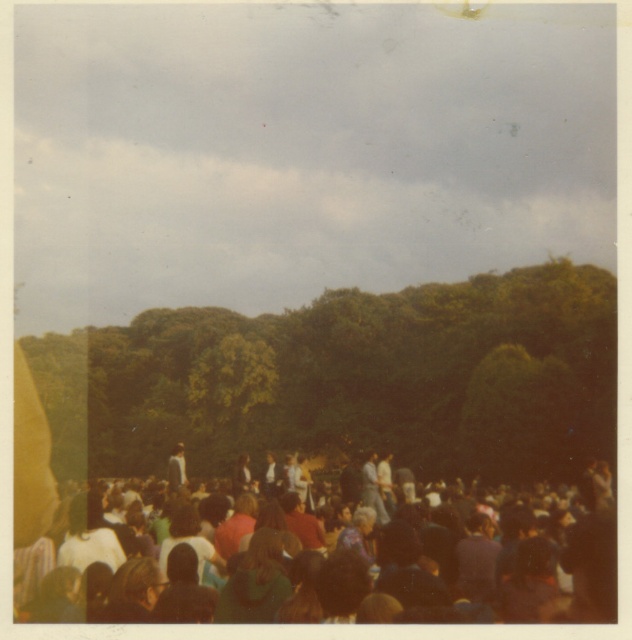
You are a photographer at the event and want to capture a photo that includes both the green leafy tree at center and the multicolored fabric crowd at lower center. Which object should you position closer to the front of your photo to ensure both are visible?

Since the green leafy tree at center is much taller than the multicolored fabric crowd at lower center, you should position the multicolored fabric crowd at lower center closer to the front of your photo to ensure both are visible.

You are a photographer at the event and want to capture a photo that includes both the green leafy tree at center and the multicolored fabric crowd at lower center. However, you need to ensure that the crowd is visible in the background. Is the current arrangement of these objects suitable for this purpose?

The multicolored fabric crowd at lower center is behind the green leafy tree at center, so the crowd will appear in the background behind the tree, making it suitable for the photo.

You are at the center of the outdoor gathering and want to find a spot under the green leafy tree at center for shade. Based on the coordinates provided, is the tree directly in front of you or to one side?

The green leafy tree at center is located at coordinates point (349,380), which places it slightly to the right and forward from the center point, so it is not directly in front but to the right side.